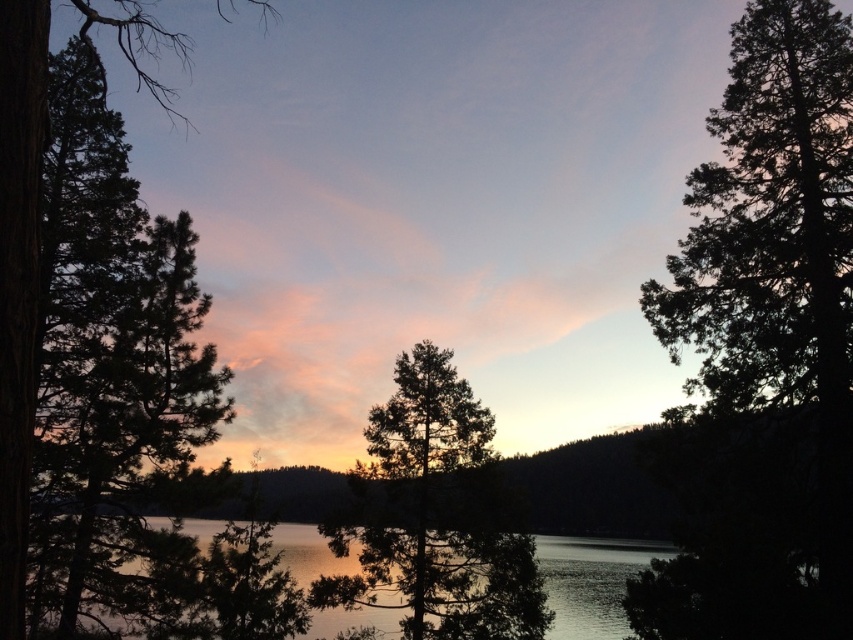
You are standing in the middle of a forest path and see the green textured pine tree at left and the glistening silver water at center. Which object would appear larger to you?

The green textured pine tree at left appears larger because it is closer to the viewer than the glistening silver water at center.

You are standing in front of the sunset scene and want to take a photo of both the green textured tree at center and the green textured pine tree at left. Which tree should you move closer to if you want both to be fully visible in your photo?

You should move closer to the green textured pine tree at left because the green textured tree at center is positioned on the right side of it, allowing both trees to be captured in the frame when closer to the left tree.

You are a photographer standing at the edge of the water. You want to capture the sunset with both the green textured pine tree at left and the glistening silver water at center in your shot. Based on their positions, can you include both in your frame without moving your position?

The green textured pine tree at left is positioned over glistening silver water at center, so yes, you can include both in your frame without moving your position as the tree is above the water in the scene.